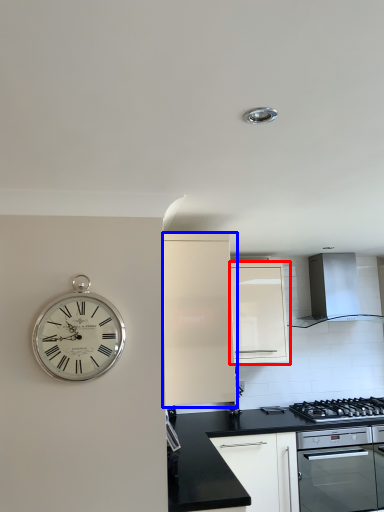
Question: Which object appears closest to the camera in this image, cabinetry (highlighted by a red box) or cabinetry (highlighted by a blue box)?

Choices:
 (A) cabinetry
 (B) cabinetry

Answer: (B)